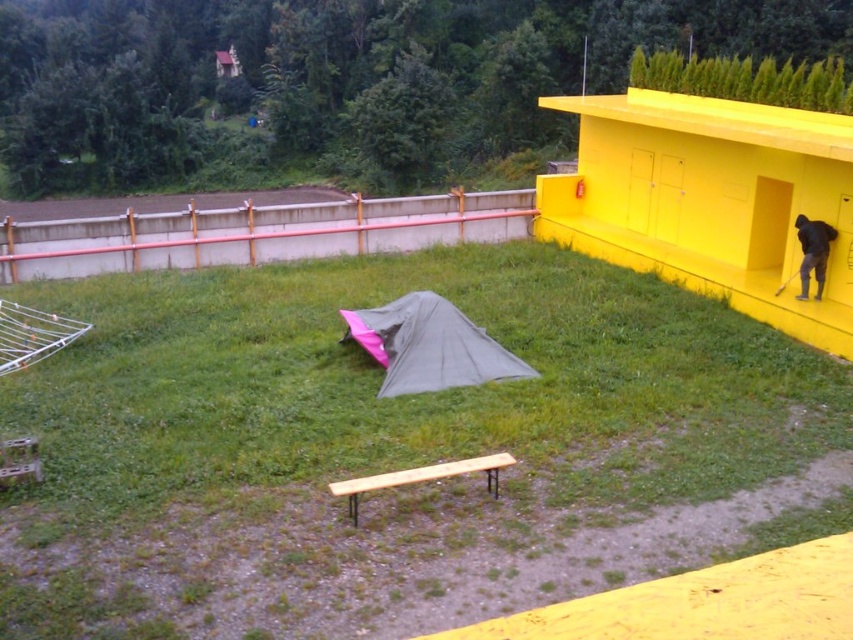
Question: Which point is farther to the camera?

Choices:
 (A) (107, 320)
 (B) (817, 225)

Answer: (A)

Question: In this image, where is green grassy at center located relative to dark gray fabric at right?

Choices:
 (A) above
 (B) below

Answer: (B)

Question: Which point is farther from the camera taking this photo?

Choices:
 (A) (758, 406)
 (B) (801, 284)

Answer: (B)

Question: Does green grassy at center have a lesser width compared to dark gray fabric at right?

Choices:
 (A) no
 (B) yes

Answer: (A)

Question: Is green grassy at center further to the viewer compared to dark gray fabric at right?

Choices:
 (A) no
 (B) yes

Answer: (A)